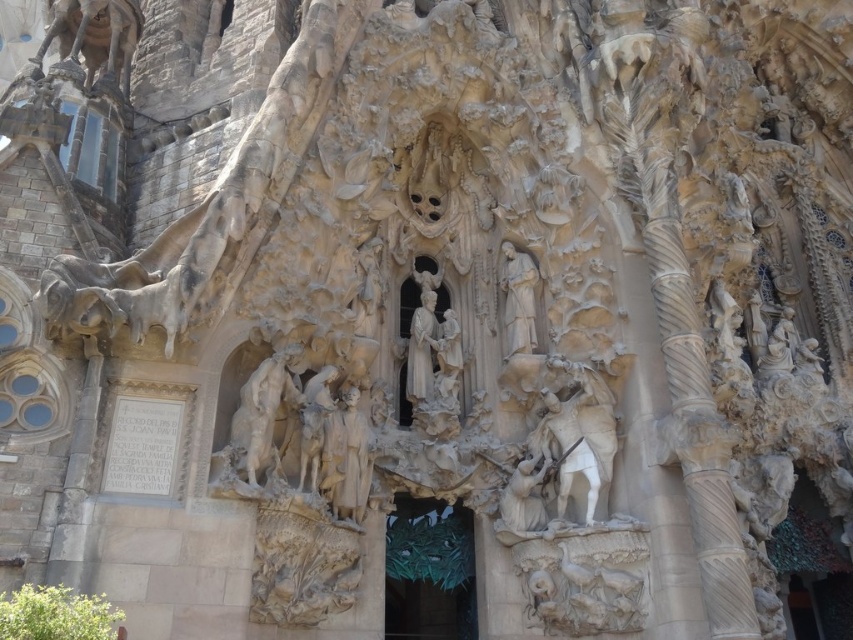
You are standing at the Sagrada Familia and want to take a photo of the point at coordinates (x=338, y=490). If your camera has a maximum focus range of 60 meters, will you be able to focus on that point?

The point at coordinates (x=338, y=490) is 67.91 meters away from the camera. Since this distance exceeds the camera maximum focus range of 60 meters, the camera will not be able to focus on that point.

You are standing in front of the Sagrada Familia and want to take a photo of the white stone statue at center. If your camera can focus on objects up to 200 feet away, will you be able to capture a clear image of the statue?

The white stone statue at center is 216.53 feet away from the viewer. Since the camera can only focus up to 200 feet, it will not be able to capture a clear image of the statue.

You are an architect analyzing the Sagrada Familia facade. You notice the white marble horse at right and the white stone statue at center. Which of these two objects is taller?

The white marble horse at right is taller than the white stone statue at center.